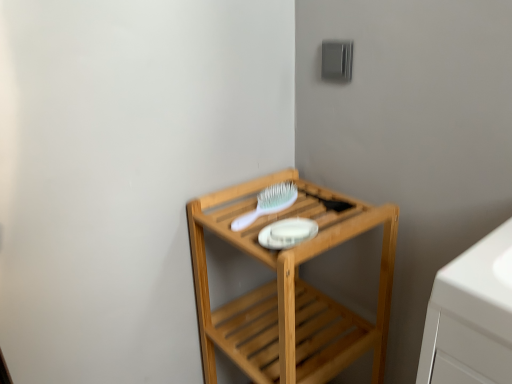
The height and width of the screenshot is (384, 512). In order to click on unoccupied space behind white plastic brush at upper center in this screenshot , I will do `click(265, 189)`.